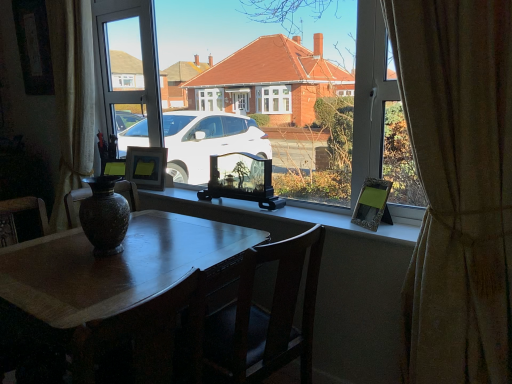
Identify the location of spots to the right of metallic silver picture frame at right, the 1th picture frame in the right-to-left sequence. (398, 222).